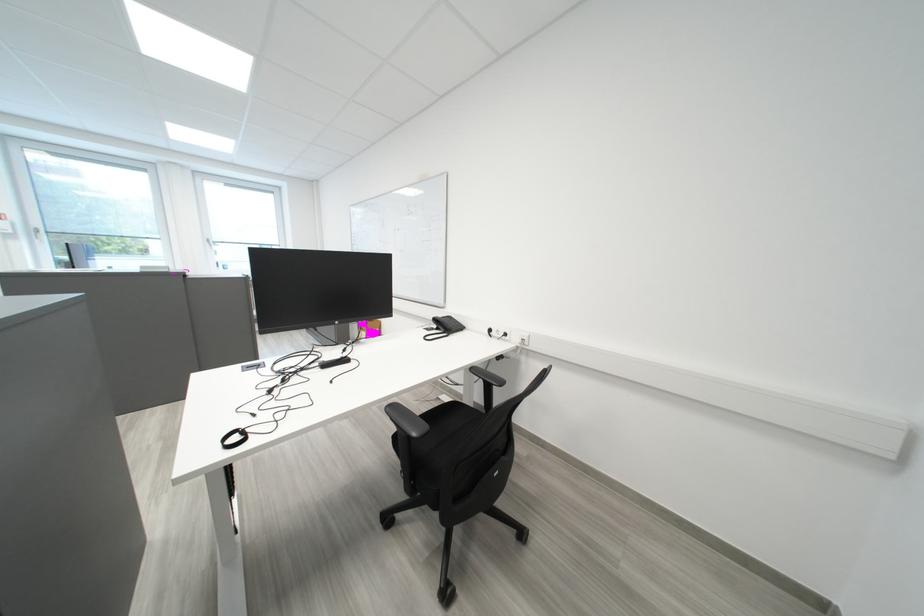
Image resolution: width=924 pixels, height=616 pixels. What do you see at coordinates (450, 416) in the screenshot? I see `a black chair sitting surface` at bounding box center [450, 416].